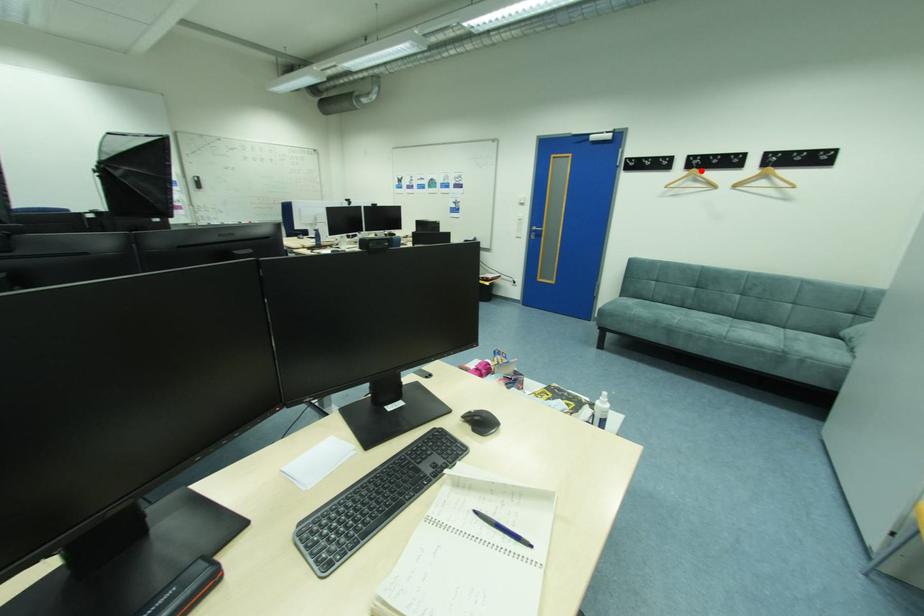
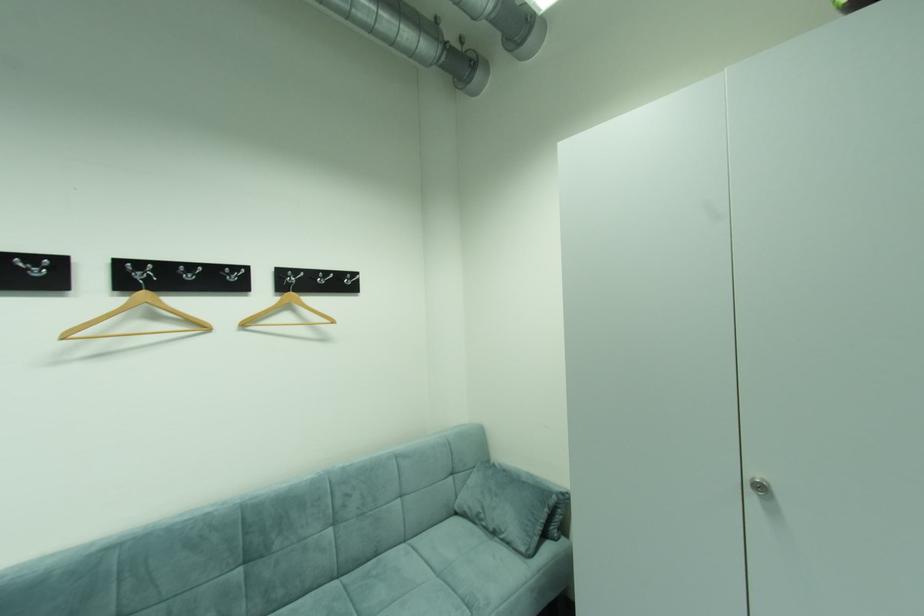
Locate, in the second image, the point that corresponds to the highlighted location in the first image.

(150, 294)